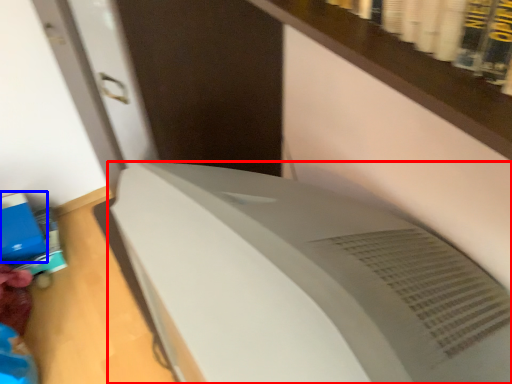
Question: Which object appears farthest to the camera in this image, home appliance (highlighted by a red box) or paperback book (highlighted by a blue box)?

Choices:
 (A) home appliance
 (B) paperback book

Answer: (B)